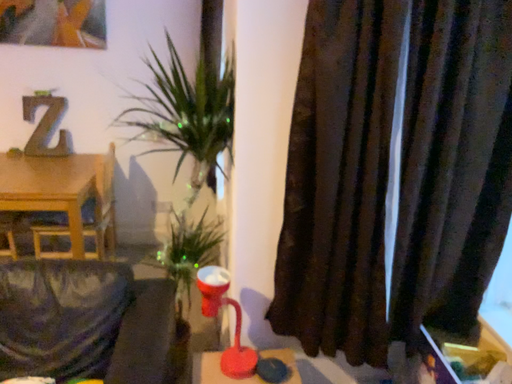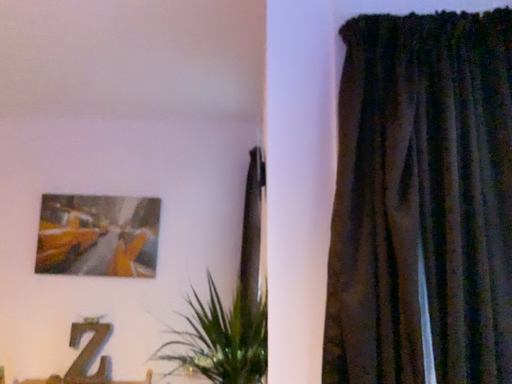
Question: Which way did the camera rotate in the video?

Choices:
 (A) rotated upward
 (B) rotated downward

Answer: (A)